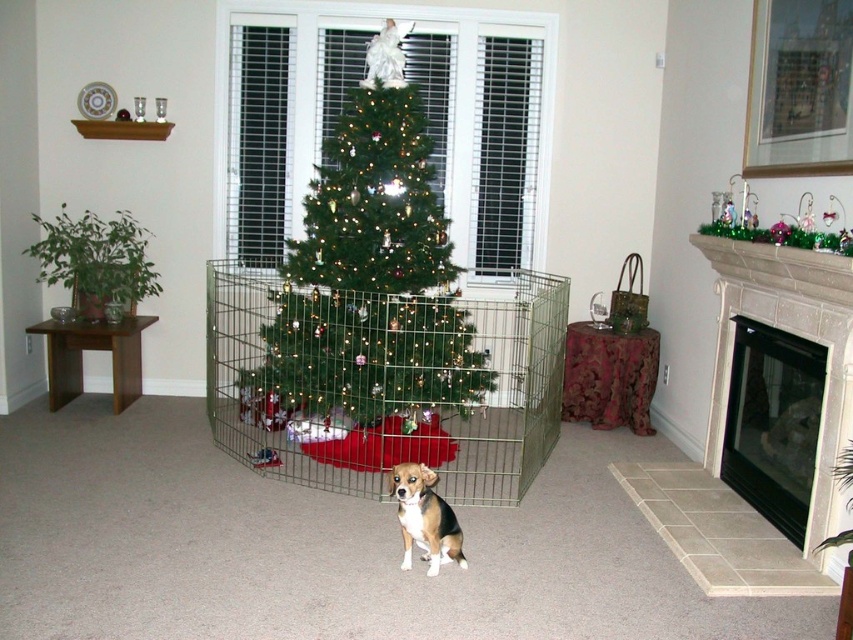
You are standing in the living room and want to place a new decoration exactly at the point marked by the coordinates point (x=372, y=269). Which object is located at that position?

The point (x=372, y=269) corresponds to the green matte christmas tree at center.

You are a guest in the living room and want to walk from the entrance to the white marble fireplace at right. Is the metallic wire cage at center blocking your path?

The metallic wire cage at center is further to the viewer than white marble fireplace at right, so the metallic wire cage at center is closer to you. Therefore, the metallic wire cage at center would block your path to the white marble fireplace at right.

You are a guest in the living room and want to walk from the entrance to the black glass fireplace at lower right. Is the brown and white fur dog at center blocking your path?

The black glass fireplace at lower right is further to the viewer than brown and white fur dog at center, so the brown and white fur dog at center is closer to you. Therefore, the dog is blocking your path to the fireplace.